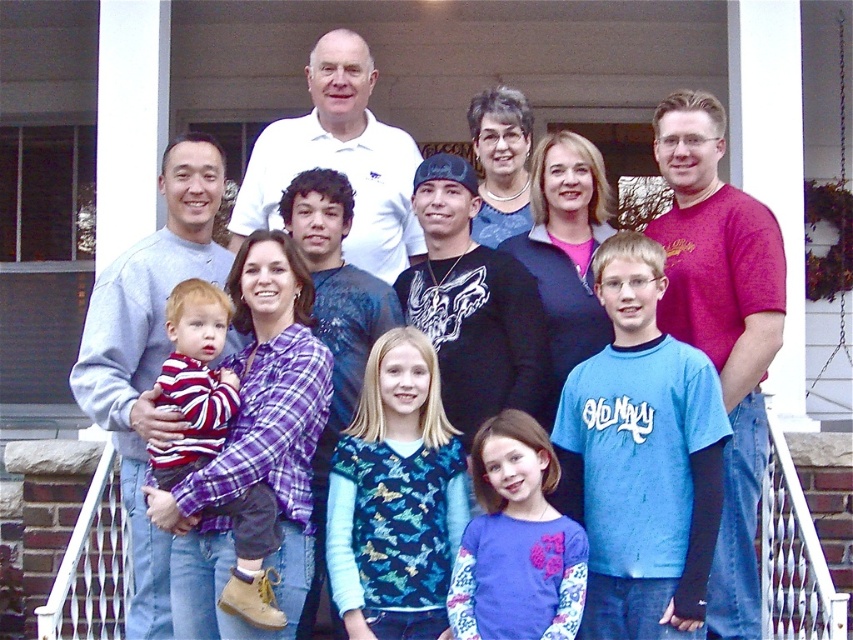
Is point (207, 168) positioned in front of point (473, 470)?

No.

Is gray sweater at left wider than purple fleece shirt at center?

Indeed, gray sweater at left has a greater width compared to purple fleece shirt at center.

Locate an element on the screen. gray sweater at left is located at coordinates (148, 353).

How much distance is there between matte red t-shirt at right and white polo shirt at upper center?

A distance of 11.77 meters exists between matte red t-shirt at right and white polo shirt at upper center.

Between matte red t-shirt at right and white polo shirt at upper center, which one is positioned higher?

white polo shirt at upper center is higher up.

The height and width of the screenshot is (640, 853). What are the coordinates of `matte red t-shirt at right` in the screenshot? It's located at (721, 324).

In the scene shown: Measure the distance between purple fleece shirt at center and camera.

The distance of purple fleece shirt at center from camera is 22.30 meters.

Does purple fleece shirt at center have a greater height compared to white polo shirt at upper center?

Correct, purple fleece shirt at center is much taller as white polo shirt at upper center.

Is point (459, 616) positioned before point (410, 211)?

Yes, point (459, 616) is in front of point (410, 211).

At what (x,y) coordinates should I click in order to perform the action: click on purple fleece shirt at center. Please return your answer as a coordinate pair (x, y). The width and height of the screenshot is (853, 640). Looking at the image, I should click on (515, 541).